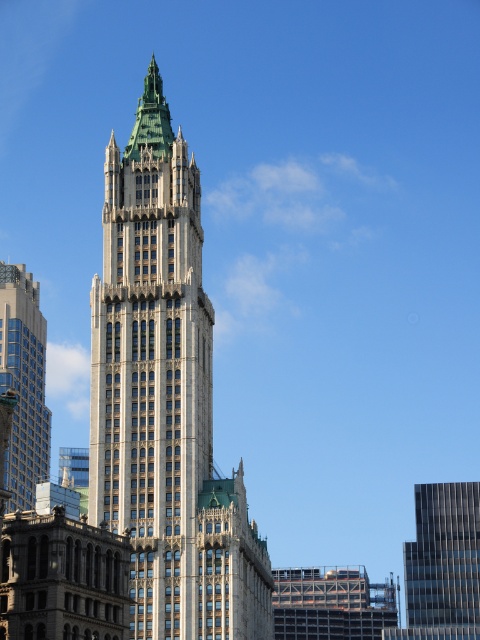
You are an architect evaluating the two skyscrapers in the scene. Which of the two, the glassy gray skyscraper at right or the matte glass skyscraper at left, has a greater height?

The matte glass skyscraper at left is taller than the glassy gray skyscraper at right.

What are the coordinates of the glassy gray skyscraper at right?

The glassy gray skyscraper at right is located at coordinates point (443, 564).